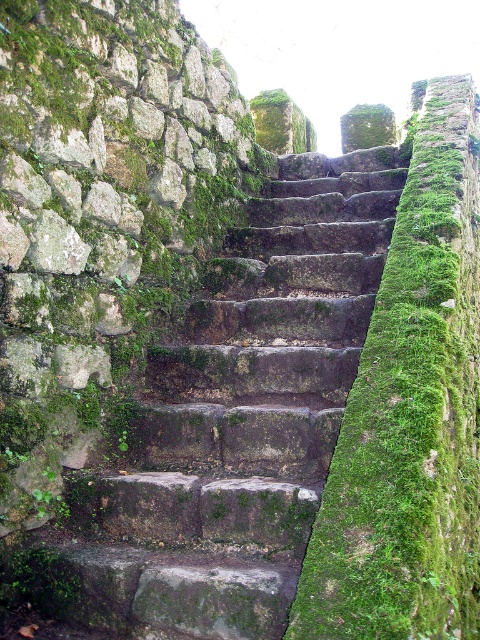
Which is behind, point (32, 564) or point (360, 492)?

The point (32, 564) is more distant.

Does rusty stone stairs at center have a lesser width compared to green mossy wall at center?

Incorrect, rusty stone stairs at center's width is not less than green mossy wall at center's.

Is point (295, 444) positioned after point (423, 406)?

Yes, it is behind point (423, 406).

I want to click on rusty stone stairs at center, so click(231, 422).